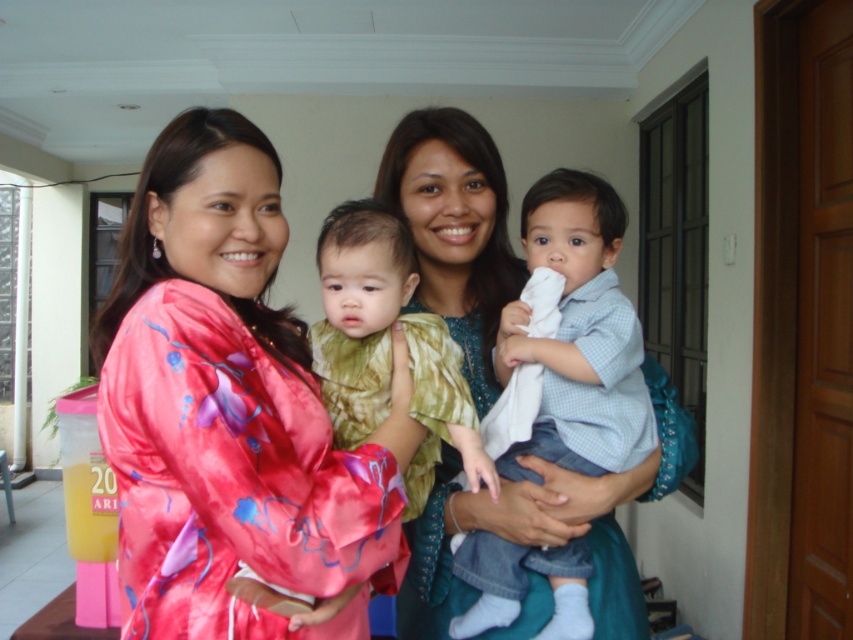
Which of these two, pink satin robe at left or light blue denim shirt at center, stands shorter?

With less height is pink satin robe at left.

Between pink satin robe at left and light blue denim shirt at center, which one appears on the right side from the viewer's perspective?

light blue denim shirt at center is more to the right.

Which is in front, point (222, 396) or point (572, 561)?

Point (222, 396) is more forward.

Image resolution: width=853 pixels, height=640 pixels. Identify the location of pink satin robe at left. (234, 476).

Measure the distance between pink satin robe at left and camera.

They are 32.50 inches apart.

Which of these two, pink satin robe at left or green textured dress at center, stands taller?

With more height is green textured dress at center.

Who is more forward, [229,508] or [358,342]?

Positioned in front is point [229,508].

Find the location of `pink satin robe at left`. pink satin robe at left is located at coordinates (234, 476).

Can you confirm if light blue denim shirt at center is positioned to the left of green textured dress at center?

In fact, light blue denim shirt at center is to the right of green textured dress at center.

Between point (517, 364) and point (329, 408), which one is positioned in front?

Point (329, 408)

At what (x,y) coordinates should I click in order to perform the action: click on light blue denim shirt at center. Please return your answer as a coordinate pair (x, y). Looking at the image, I should click on (578, 336).